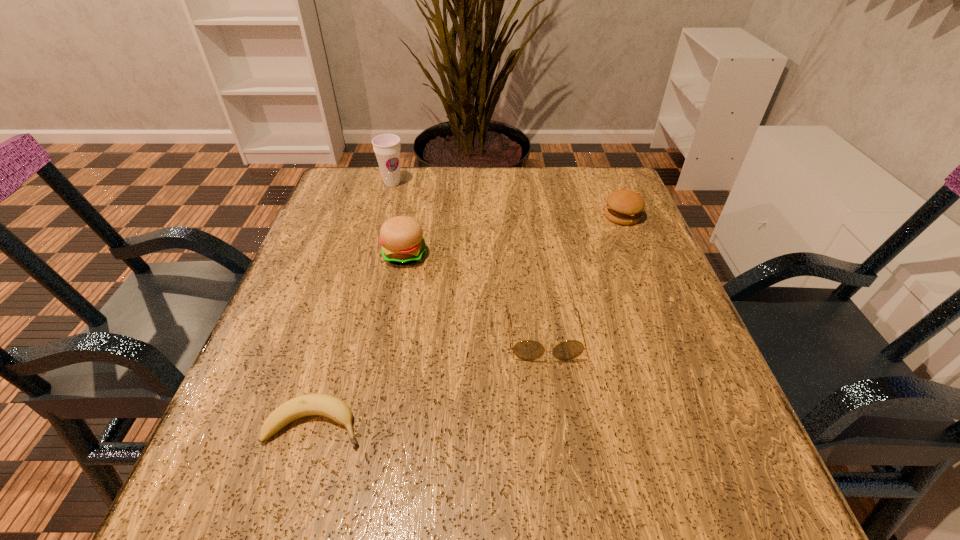
Where is `vacant space located on the right of the cup`? vacant space located on the right of the cup is located at coordinates (512, 183).

This screenshot has height=540, width=960. I want to click on vacant region located 0.310m on the right of the left hamburger, so click(569, 254).

Image resolution: width=960 pixels, height=540 pixels. Find the location of `vacant space situated 0.360m on the front of the right hamburger`. vacant space situated 0.360m on the front of the right hamburger is located at coordinates (677, 350).

Where is `free space located on the lenses of the fourth farthest object`? The width and height of the screenshot is (960, 540). free space located on the lenses of the fourth farthest object is located at coordinates (564, 490).

This screenshot has width=960, height=540. Find the location of `vacant space located at the stem of the nearest object`. vacant space located at the stem of the nearest object is located at coordinates (469, 425).

Where is `cup present at the far edge`? The height and width of the screenshot is (540, 960). cup present at the far edge is located at coordinates (387, 147).

The image size is (960, 540). I want to click on hamburger that is at the far edge, so click(x=624, y=207).

This screenshot has width=960, height=540. I want to click on cup that is at the left edge, so click(x=387, y=147).

In order to click on banana situated at the left edge in this screenshot , I will do `click(331, 407)`.

Image resolution: width=960 pixels, height=540 pixels. In order to click on object at the right edge in this screenshot , I will do `click(624, 207)`.